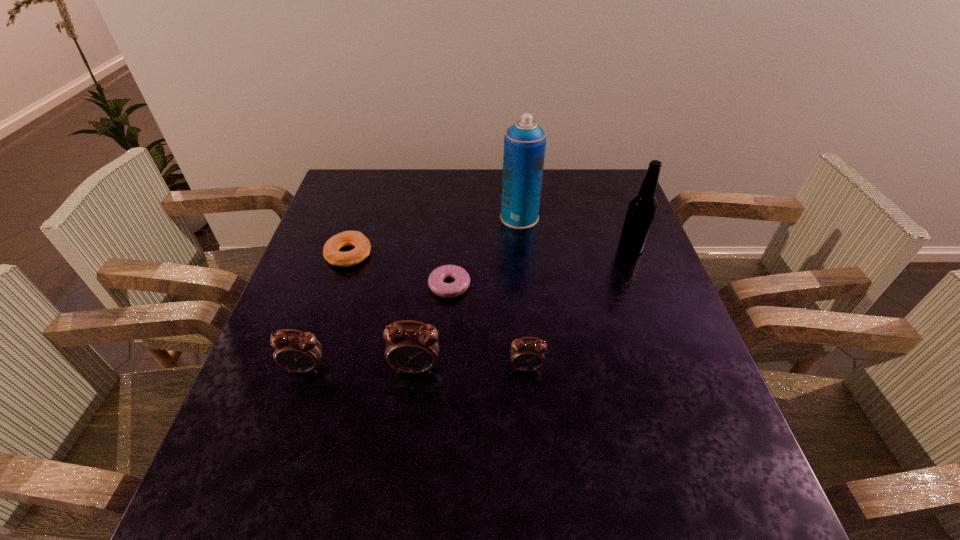
Find the location of a particular element. The height and width of the screenshot is (540, 960). the rightmost object is located at coordinates (642, 207).

Identify the location of doughnut. This screenshot has width=960, height=540. (462, 280).

You are a GUI agent. You are given a task and a screenshot of the screen. Output one action in this format:
    pyautogui.click(x=<x>, y=<y>)
    Task: Click on the shortest object
    This screenshot has width=960, height=540.
    Given the screenshot: What is the action you would take?
    pyautogui.click(x=462, y=280)

Where is `free space located 0.070m on the face of the tallest alarm clock`? The height and width of the screenshot is (540, 960). free space located 0.070m on the face of the tallest alarm clock is located at coordinates (411, 408).

You are a GUI agent. You are given a task and a screenshot of the screen. Output one action in this format:
    pyautogui.click(x=<x>, y=<y>)
    Task: Click on the vacant space situated on the face of the shortest alarm clock
    The height and width of the screenshot is (540, 960).
    Given the screenshot: What is the action you would take?
    pyautogui.click(x=532, y=434)

The width and height of the screenshot is (960, 540). Find the location of `free space located 0.130m on the front of the aerosol can`. free space located 0.130m on the front of the aerosol can is located at coordinates (524, 260).

I want to click on vacant space located 0.130m on the front of the bagel, so click(x=331, y=308).

The height and width of the screenshot is (540, 960). Find the location of `vacant region located 0.360m on the front of the rightmost object`. vacant region located 0.360m on the front of the rightmost object is located at coordinates (677, 372).

The height and width of the screenshot is (540, 960). Identify the location of free space located 0.150m on the front of the doughnut. (444, 352).

Locate an element on the screen. This screenshot has height=540, width=960. object that is positioned at the far edge is located at coordinates (525, 141).